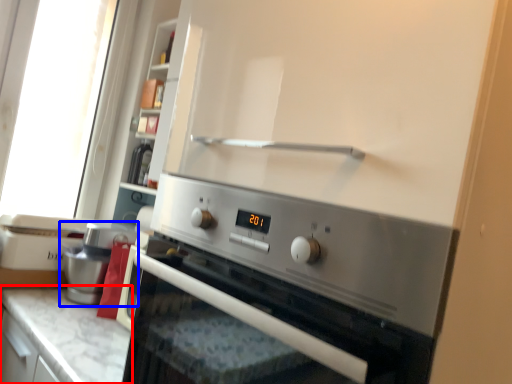
Question: Which point is further to the camera, countertop (highlighted by a red box) or coffee machine (highlighted by a blue box)?

Choices:
 (A) countertop
 (B) coffee machine

Answer: (B)